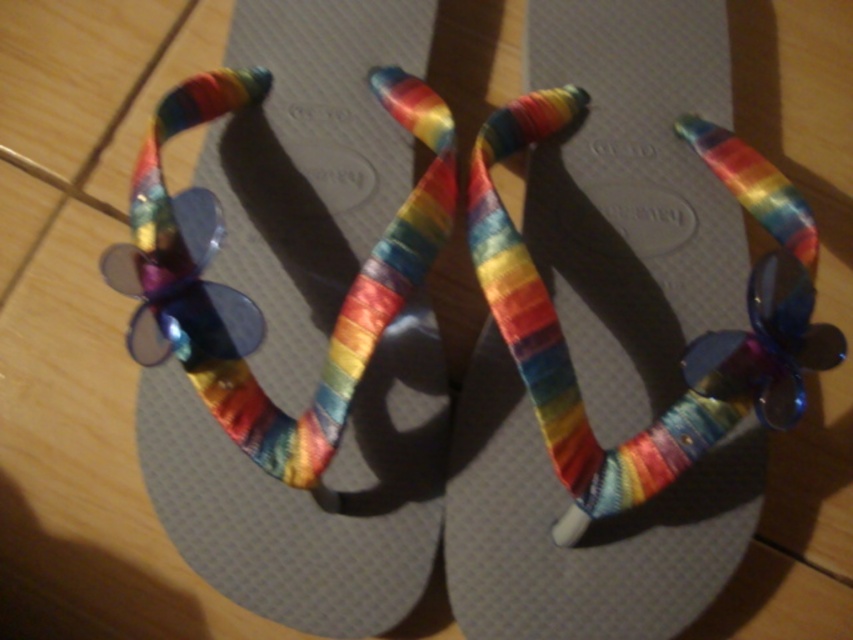
Does point (200, 573) come closer to viewer compared to point (695, 320)?

Yes, it is.

Does rainbow fabric sandal at center have a smaller size compared to rainbow fabric flip-flop at center?

Actually, rainbow fabric sandal at center might be larger than rainbow fabric flip-flop at center.

Which is behind, point (430, 552) or point (543, 152)?

Positioned behind is point (543, 152).

You are a GUI agent. You are given a task and a screenshot of the screen. Output one action in this format:
    pyautogui.click(x=<x>, y=<y>)
    Task: Click on the rainbow fabric sandal at center
    
    Given the screenshot: What is the action you would take?
    pyautogui.click(x=312, y=496)

Between rainbow fabric ribbon at center and rainbow fabric flip-flop at center, which one has less height?

With less height is rainbow fabric ribbon at center.

Does rainbow fabric ribbon at center have a larger size compared to rainbow fabric flip-flop at center?

Yes.

Is point (450, 188) closer to viewer compared to point (554, 243)?

Yes, it is.

Identify the location of rainbow fabric ribbon at center. The image size is (853, 640). (250, 300).

Looking at this image, is rainbow fabric sandal at center wider than rainbow fabric ribbon at center?

Incorrect, rainbow fabric sandal at center's width does not surpass rainbow fabric ribbon at center's.

Is rainbow fabric sandal at center shorter than rainbow fabric ribbon at center?

No, rainbow fabric sandal at center is not shorter than rainbow fabric ribbon at center.

At what (x,y) coordinates should I click in order to perform the action: click on rainbow fabric sandal at center. Please return your answer as a coordinate pair (x, y). This screenshot has height=640, width=853. Looking at the image, I should click on (312, 496).